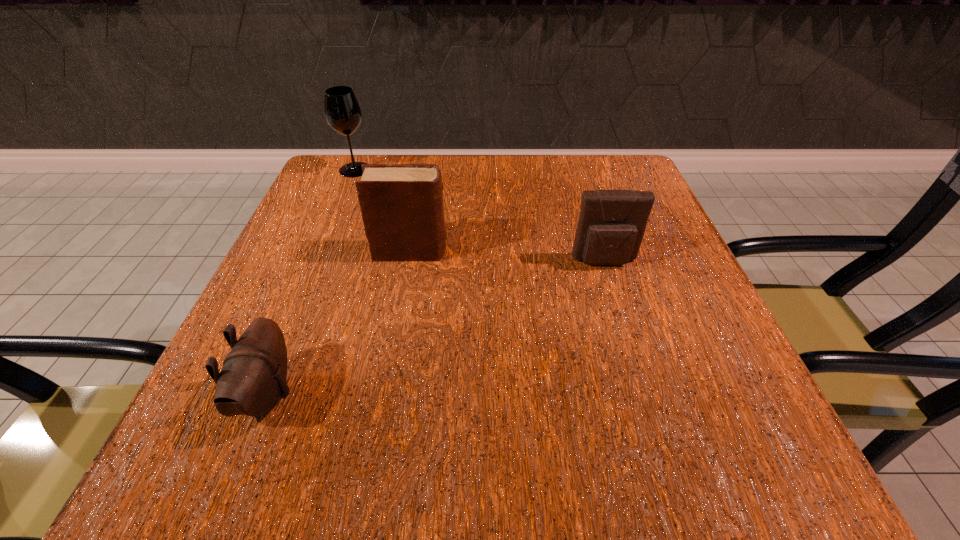
Identify the location of wineglass. (342, 111).

In order to click on the second object from right to left in this screenshot , I will do `click(402, 209)`.

The width and height of the screenshot is (960, 540). I want to click on the rightmost object, so click(x=612, y=223).

This screenshot has height=540, width=960. Identify the location of the right pouch. (612, 223).

Where is `the nearer pouch`? the nearer pouch is located at coordinates (252, 380).

At what (x,y) coordinates should I click in order to perform the action: click on the shortest object. Please return your answer as a coordinate pair (x, y). Looking at the image, I should click on (252, 380).

Identify the location of free space located 0.270m on the front of the wineglass. (320, 255).

Locate an element on the screen. The width and height of the screenshot is (960, 540). vacant region located on the spine side of the diary is located at coordinates [568, 252].

This screenshot has height=540, width=960. I want to click on vacant region located with an open flap on the rightmost object, so click(x=673, y=480).

Where is `free location located with the flap open on the nearer pouch`? The image size is (960, 540). free location located with the flap open on the nearer pouch is located at coordinates (486, 394).